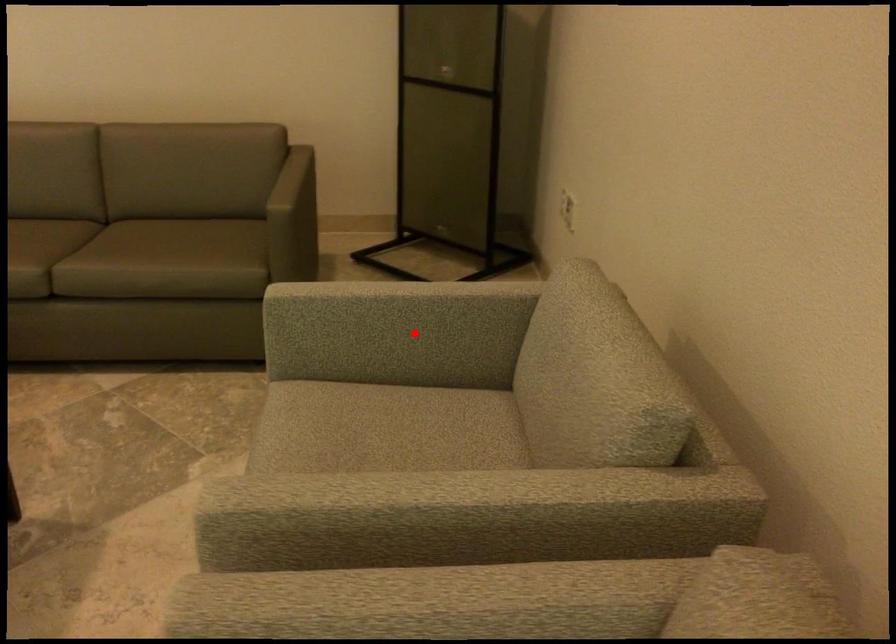
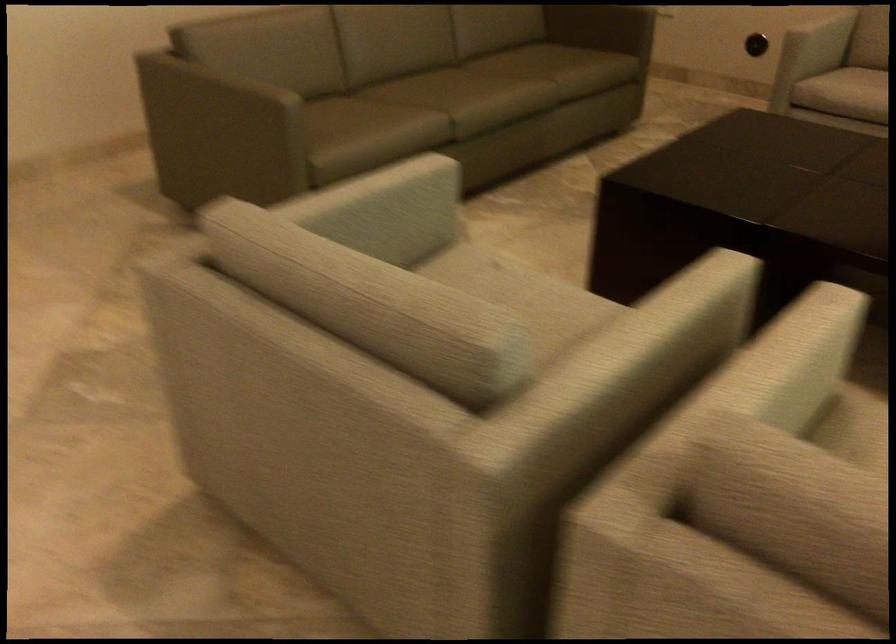
The point at the highlighted location is marked in the first image. Where is the corresponding point in the second image?

(821, 35)